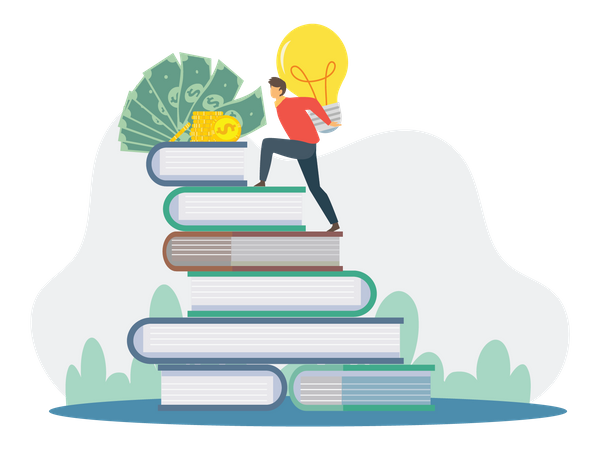
Where is `books`? This screenshot has height=450, width=600. books is located at coordinates (190, 158), (241, 213), (260, 251), (270, 290), (241, 348), (341, 394), (235, 386).